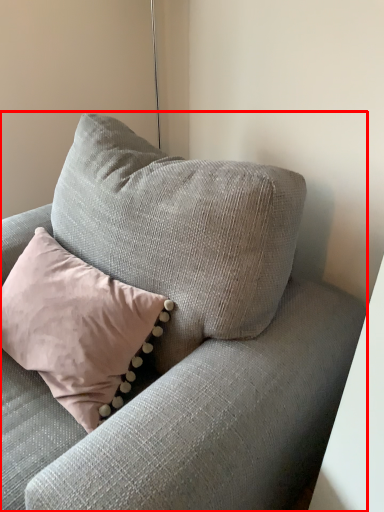
Question: From the image, what is the correct spatial relationship of studio couch (annotated by the red box) in relation to pillow?

Choices:
 (A) right
 (B) left

Answer: (A)